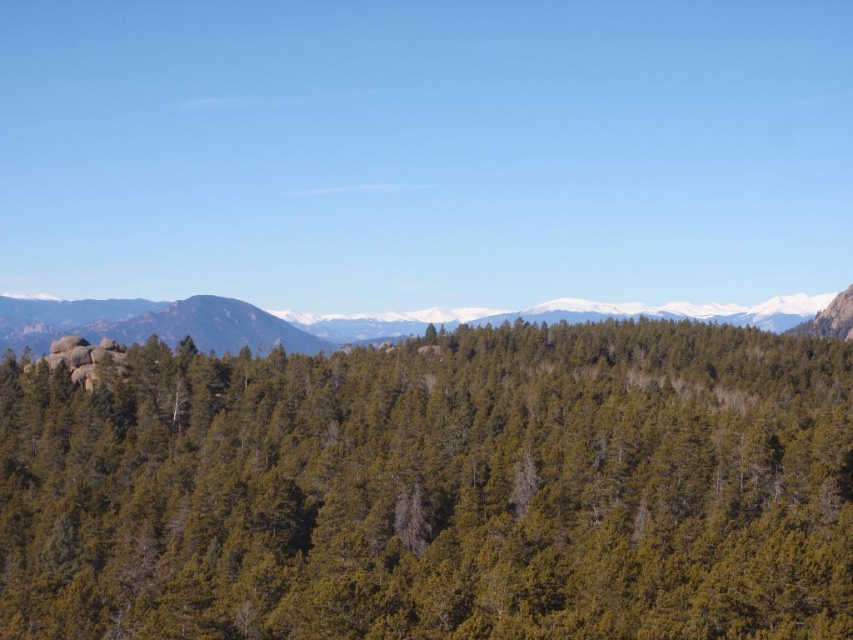
Question: Is the position of green matte tree at center more distant than that of green forested hillside at center?

Choices:
 (A) yes
 (B) no

Answer: (B)

Question: Considering the relative positions of green matte tree at center and green forested hillside at center in the image provided, where is green matte tree at center located with respect to green forested hillside at center?

Choices:
 (A) below
 (B) above

Answer: (A)

Question: Is green matte tree at center to the left of green forested hillside at center from the viewer's perspective?

Choices:
 (A) no
 (B) yes

Answer: (A)

Question: Which object appears closest to the camera in this image?

Choices:
 (A) green matte tree at center
 (B) green forested hillside at center

Answer: (A)

Question: Which object is closer to the camera taking this photo?

Choices:
 (A) green forested hillside at center
 (B) green matte tree at center

Answer: (B)